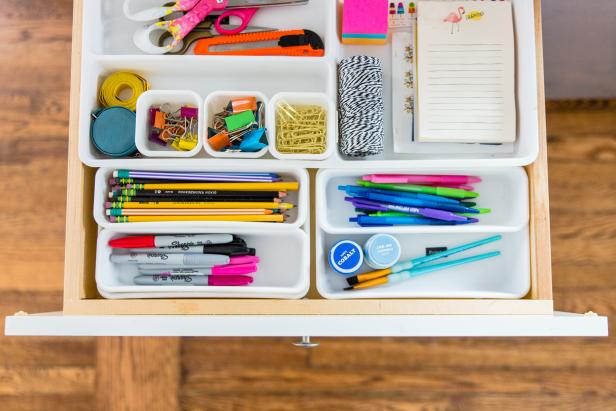
The image size is (616, 411). In order to click on trays in this screenshot , I will do `click(275, 247)`, `click(290, 207)`, `click(464, 271)`, `click(496, 209)`, `click(379, 53)`, `click(298, 17)`, `click(310, 108)`, `click(229, 114)`, `click(187, 118)`, `click(176, 76)`.